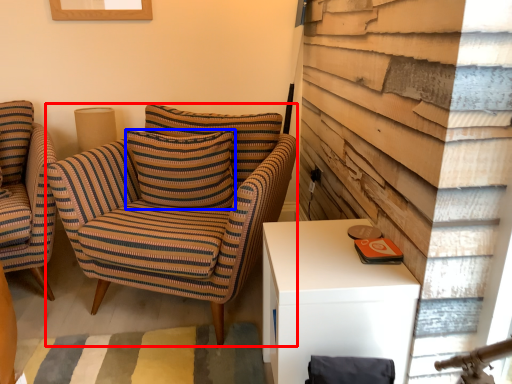
Question: Which point is further to the camera, chair (highlighted by a red box) or pillow (highlighted by a blue box)?

Choices:
 (A) chair
 (B) pillow

Answer: (B)